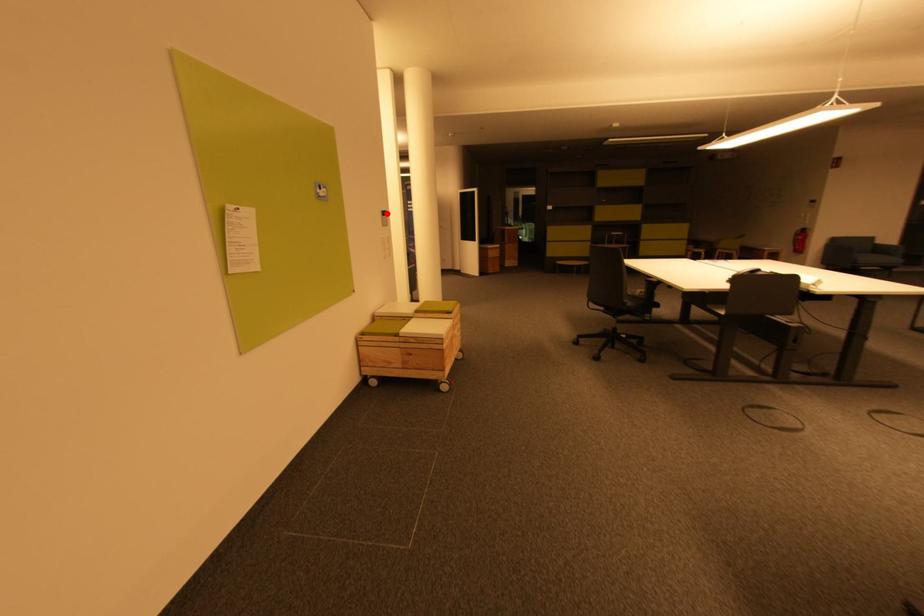
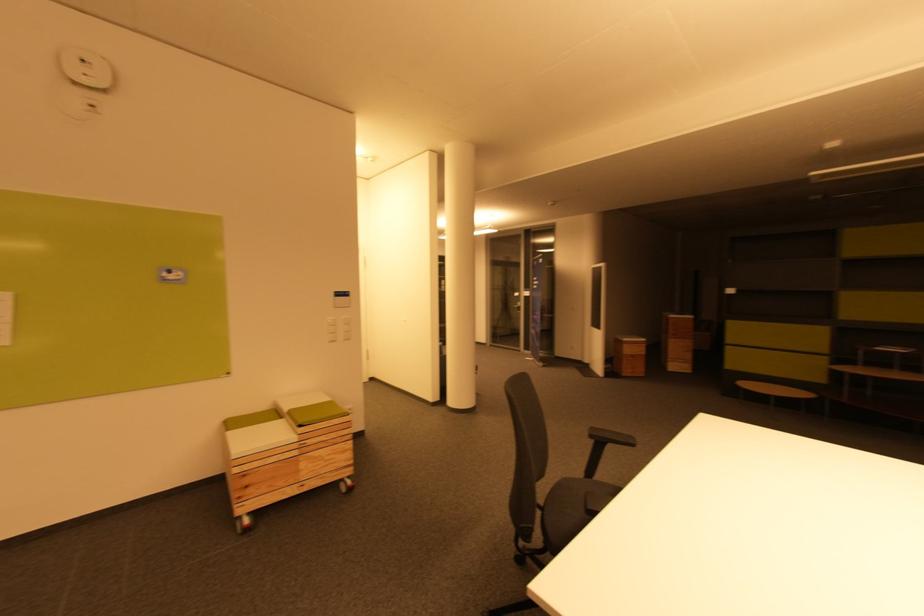
The point at the highlighted location is marked in the first image. Where is the corresponding point in the second image?

(342, 294)